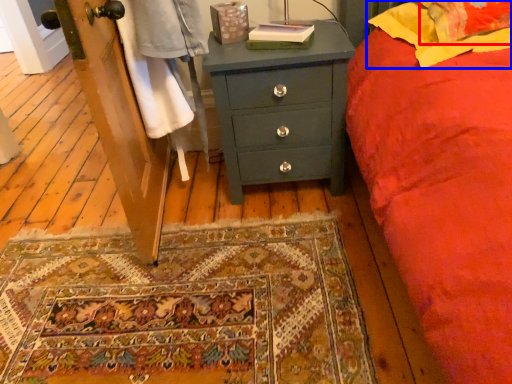
Question: Which of the following is the closest to the observer, pillow (highlighted by a red box) or pillow (highlighted by a blue box)?

Choices:
 (A) pillow
 (B) pillow

Answer: (B)